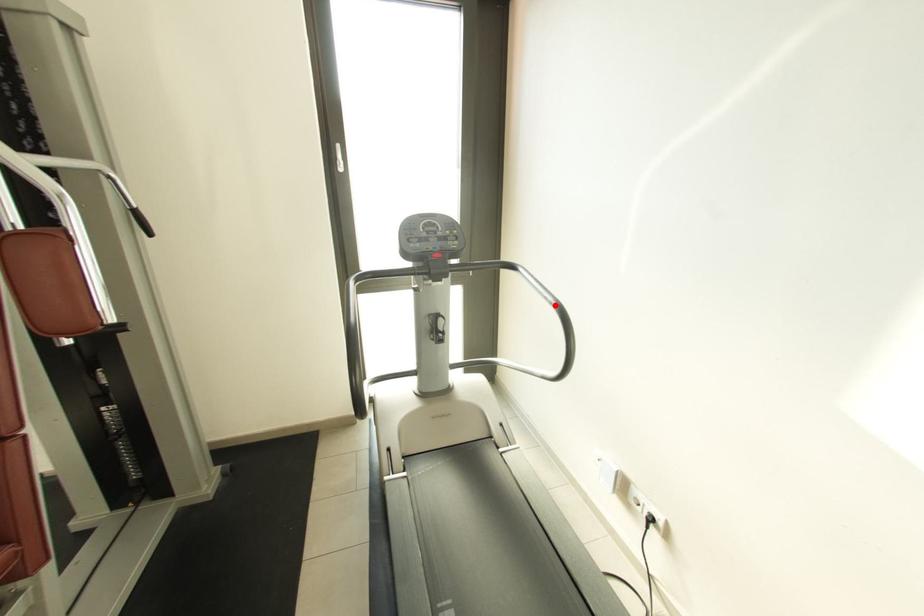
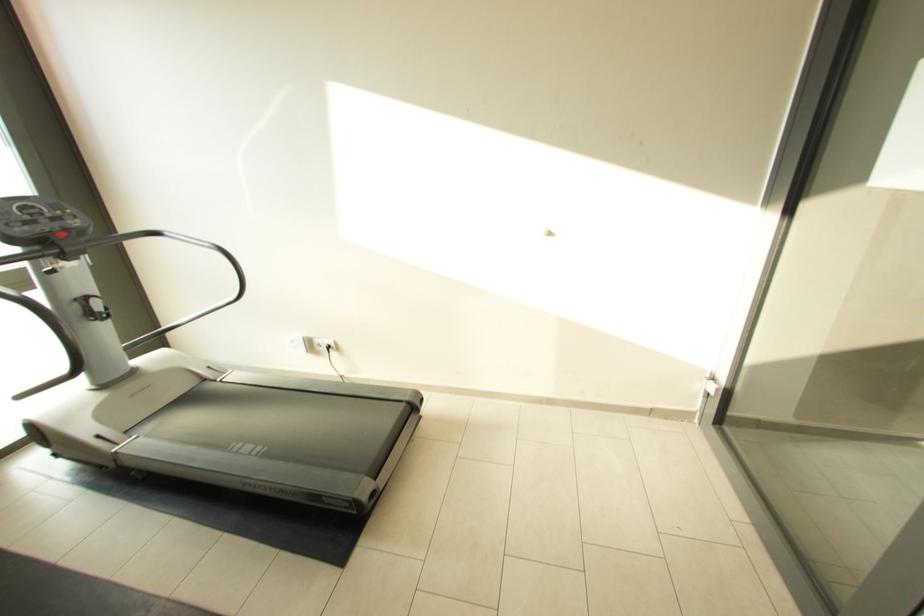
Where in the second image is the point corresponding to the highlighted location from the first image?

(214, 249)